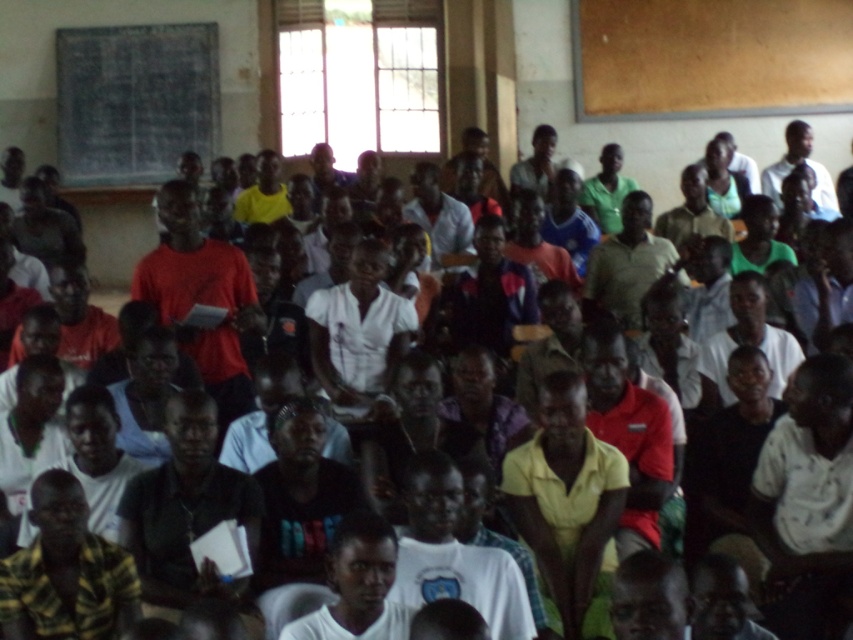
Question: Is blackboard at upper left bigger than matte red shirt at center?

Choices:
 (A) yes
 (B) no

Answer: (B)

Question: Considering the relative positions of blackboard at upper left and matte red shirt at center in the image provided, where is blackboard at upper left located with respect to matte red shirt at center?

Choices:
 (A) left
 (B) right

Answer: (A)

Question: Which point is closer to the camera taking this photo?

Choices:
 (A) click(189, 65)
 (B) click(230, 412)

Answer: (B)

Question: Which point is closer to the camera?

Choices:
 (A) matte red shirt at center
 (B) blackboard at upper left

Answer: (A)

Question: Can you confirm if blackboard at upper left is wider than matte red shirt at center?

Choices:
 (A) yes
 (B) no

Answer: (A)